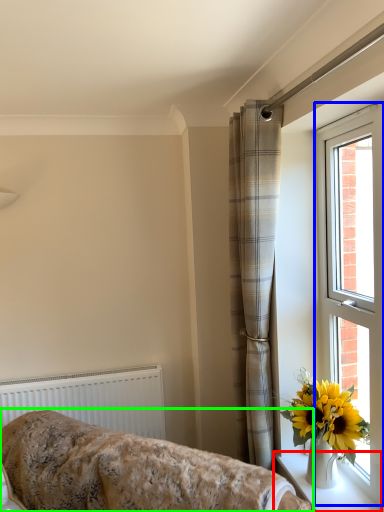
Question: Considering the real-world distances, which object is closest to window sill (highlighted by a red box)? window (highlighted by a blue box) or furniture (highlighted by a green box).

Choices:
 (A) window
 (B) furniture

Answer: (A)